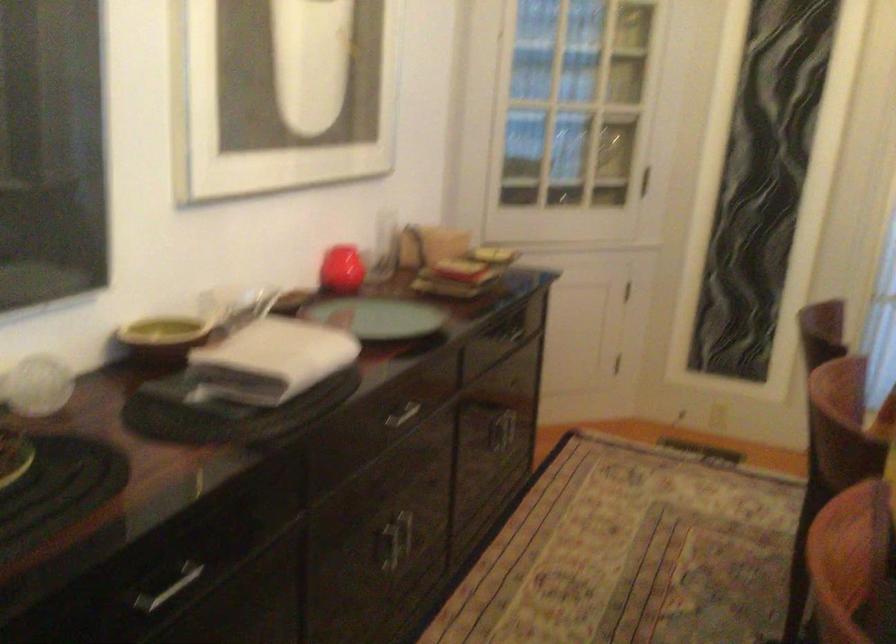
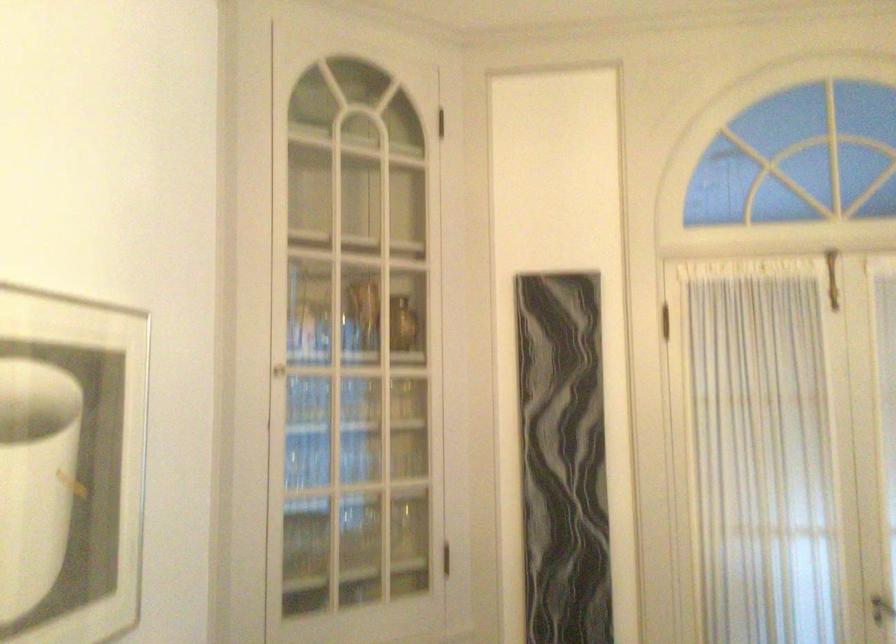
The images are taken continuously from a first-person perspective. In which direction is your viewpoint rotating?

The rotation direction of the camera is right-up.